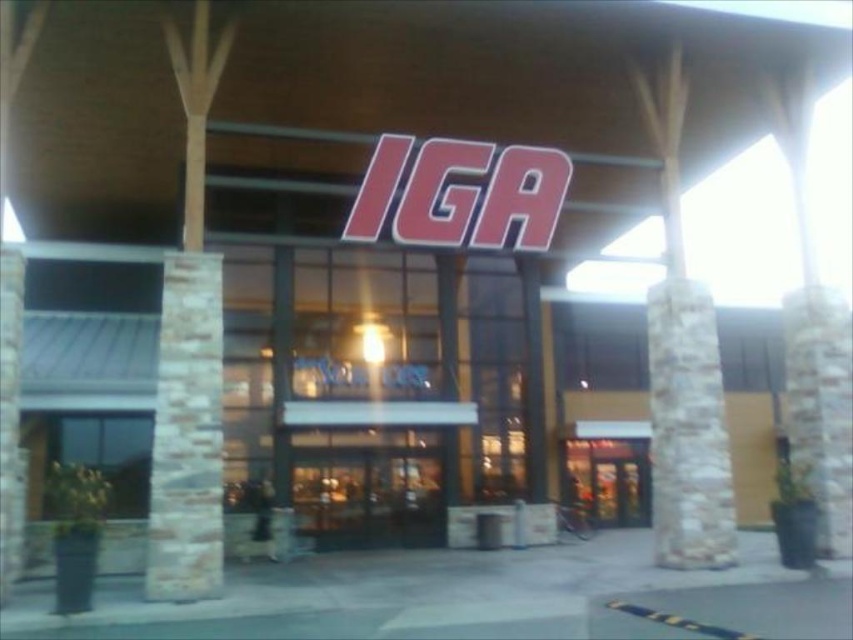
You are a delivery person with a cart that is 4 meters wide. You need to maneuver your cart between the red plastic sign at center and the stone textured pillar at right. Can you fit your cart through the space between them?

The red plastic sign at center and stone textured pillar at right are 4.36 meters apart, so yes, the cart which is 4 meters wide can fit through the space between them since the distance is wider than the cart.